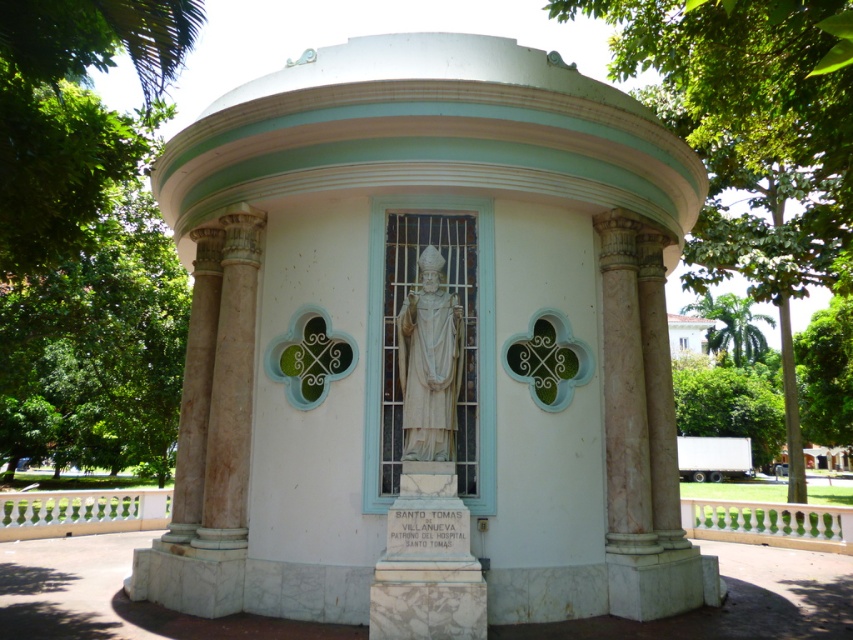
Does white marble chapel at center have a smaller size compared to white marble statue at center?

Indeed, white marble chapel at center has a smaller size compared to white marble statue at center.

Based on the photo, can you confirm if white marble chapel at center is positioned to the right of white marble statue at center?

Incorrect, white marble chapel at center is not on the right side of white marble statue at center.

Between point (194, 392) and point (434, 436), which one is positioned in front?

Point (434, 436) is in front.

Identify the location of white marble chapel at center. (463, 348).

Which is above, white marble chapel at center or green leafy tree at upper left?

green leafy tree at upper left

I want to click on white marble chapel at center, so click(463, 348).

Is white marble statue at center below green leafy palm at upper right?

No, white marble statue at center is not below green leafy palm at upper right.

You are a GUI agent. You are given a task and a screenshot of the screen. Output one action in this format:
    pyautogui.click(x=<x>, y=<y>)
    Task: Click on the white marble statue at center
    Image resolution: width=853 pixels, height=640 pixels.
    Given the screenshot: What is the action you would take?
    pyautogui.click(x=428, y=362)